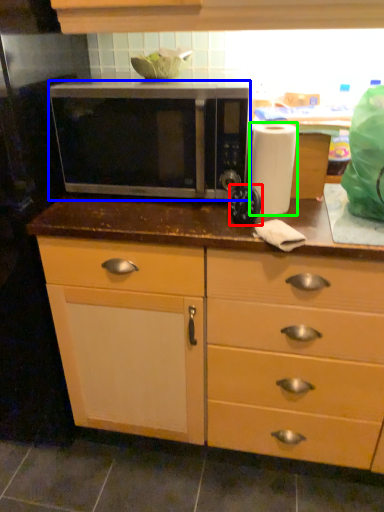
Question: Which is farther away from appliance (highlighted by a red box)? microwave oven (highlighted by a blue box) or paper towel (highlighted by a green box)?

Choices:
 (A) microwave oven
 (B) paper towel

Answer: (A)